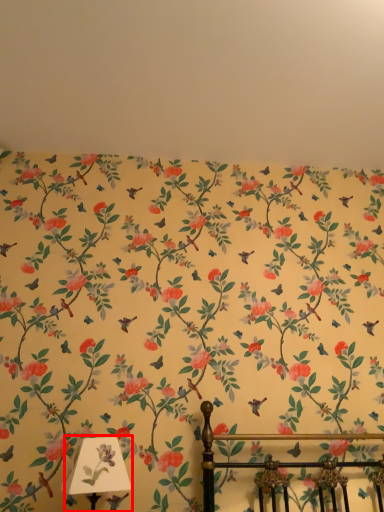
Question: From the image's perspective, where is table lamp (annotated by the red box) located in relation to backdrop in the image?

Choices:
 (A) below
 (B) above

Answer: (A)